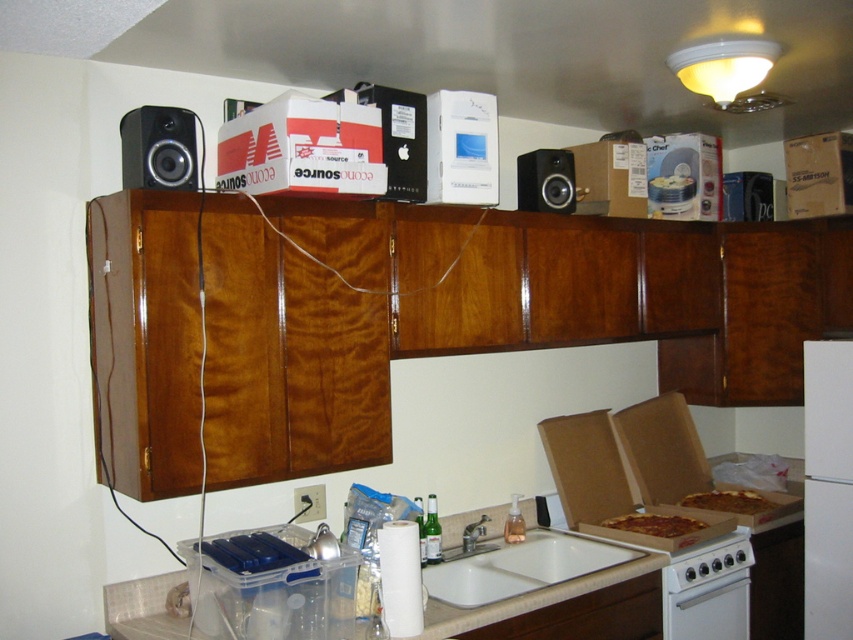
Who is lower down, white glossy oven at lower right or cheesy pizza at center?

white glossy oven at lower right is below.

Does white glossy oven at lower right have a smaller size compared to cheesy pizza at center?

Incorrect, white glossy oven at lower right is not smaller in size than cheesy pizza at center.

Find the location of a particular element. The width and height of the screenshot is (853, 640). white glossy oven at lower right is located at coordinates (708, 592).

Is white ceramic sink at lower center to the left of golden crispy pizza at lower right from the viewer's perspective?

Yes, white ceramic sink at lower center is to the left of golden crispy pizza at lower right.

Is point (492, 538) positioned in front of point (701, 497)?

That is True.

You are a GUI agent. You are given a task and a screenshot of the screen. Output one action in this format:
    pyautogui.click(x=<x>, y=<y>)
    Task: Click on the white ceramic sink at lower center
    
    Given the screenshot: What is the action you would take?
    pyautogui.click(x=520, y=566)

Is white glossy counter top at lower center positioned at the back of white glossy oven at lower right?

That is False.

Between white glossy counter top at lower center and white glossy oven at lower right, which one is positioned higher?

white glossy counter top at lower center is above.

Where is `white glossy counter top at lower center`? white glossy counter top at lower center is located at coordinates (561, 609).

Find the location of a particular element. The width and height of the screenshot is (853, 640). white glossy counter top at lower center is located at coordinates (561, 609).